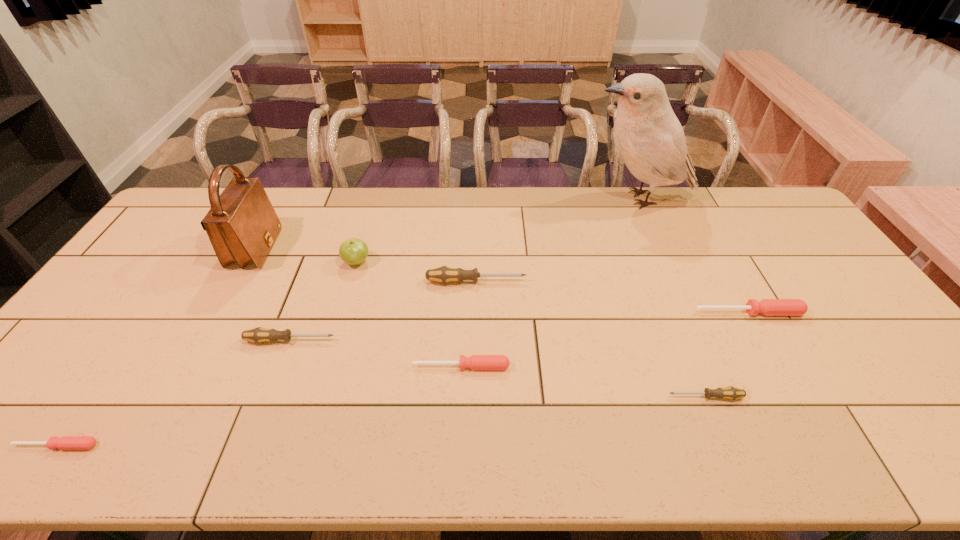
Locate an element on the screen. free space located 0.090m on the face of the tallest object is located at coordinates (559, 198).

Find the location of a particular element. vacant space situated on the front flap of the shoulder bag is located at coordinates (364, 249).

The height and width of the screenshot is (540, 960). Identify the location of vacant space located 0.120m on the right of the green apple. (409, 262).

I want to click on free space located at the tip of the farthest screwdriver, so click(596, 281).

Image resolution: width=960 pixels, height=540 pixels. What are the coordinates of `vacant space located 0.380m at the tip of the third farthest screwdriver` in the screenshot? It's located at (479, 340).

Find the location of a particular element. This screenshot has width=960, height=540. vacant space located 0.240m on the front of the rightmost red screwdriver is located at coordinates (796, 396).

Where is `free space located on the left of the third nearest object`? Image resolution: width=960 pixels, height=540 pixels. free space located on the left of the third nearest object is located at coordinates (390, 366).

The height and width of the screenshot is (540, 960). Find the location of `free point located 0.150m at the tip of the fifth farthest screwdriver`. free point located 0.150m at the tip of the fifth farthest screwdriver is located at coordinates (604, 397).

Where is `vacant area situated 0.270m at the tip of the fifth farthest screwdriver`? vacant area situated 0.270m at the tip of the fifth farthest screwdriver is located at coordinates (554, 397).

This screenshot has height=540, width=960. Identify the location of free space located 0.310m at the tip of the fifth farthest screwdriver. (537, 397).